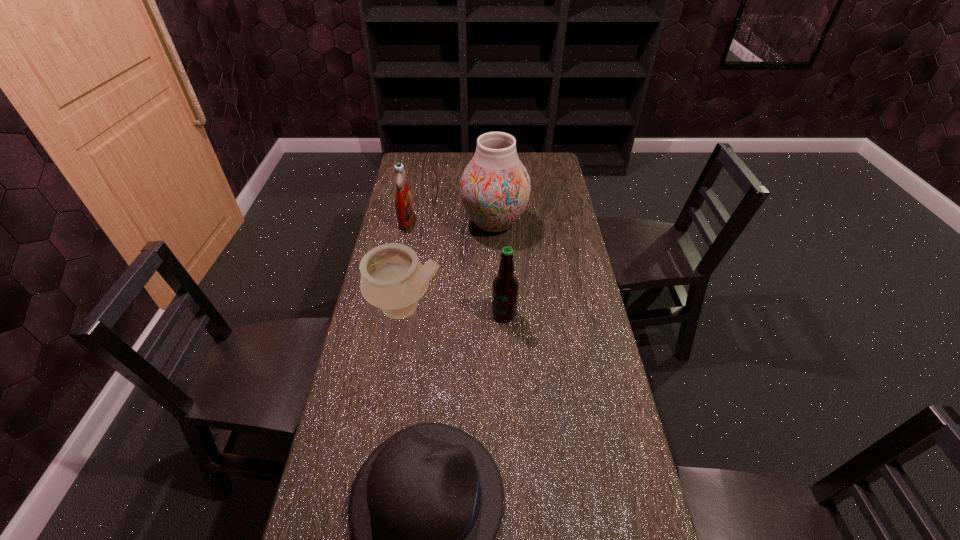
You are a GUI agent. You are given a task and a screenshot of the screen. Output one action in this format:
    pyautogui.click(x=<x>, y=<y>)
    Task: Click on the detergent that is at the left edge
    The width and height of the screenshot is (960, 540).
    Given the screenshot: What is the action you would take?
    pyautogui.click(x=403, y=199)

The width and height of the screenshot is (960, 540). Identify the location of pottery that is at the left edge. (392, 278).

Where is `vacant area at the far edge`? vacant area at the far edge is located at coordinates (442, 158).

Find the location of a particular element. The width and height of the screenshot is (960, 540). vacant space at the left edge of the desktop is located at coordinates (x=415, y=191).

You are a GUI agent. You are given a task and a screenshot of the screen. Output one action in this format:
    pyautogui.click(x=<x>, y=<y>)
    Task: Click on the vacant space at the right edge of the desktop
    
    Given the screenshot: What is the action you would take?
    pyautogui.click(x=610, y=372)

In the image, there is a desktop. At what (x,y) coordinates should I click in order to perform the action: click on vacant space at the far left corner. Please return your answer as a coordinate pair (x, y). The width and height of the screenshot is (960, 540). Looking at the image, I should click on (413, 169).

You are a GUI agent. You are given a task and a screenshot of the screen. Output one action in this format:
    pyautogui.click(x=<x>, y=<y>)
    Task: Click on the free space that is in between the pottery and the tallest object
    
    Given the screenshot: What is the action you would take?
    pyautogui.click(x=450, y=266)

I want to click on vacant region between the detergent and the beer bottle, so click(455, 267).

The width and height of the screenshot is (960, 540). In order to click on object that can be found as the fourth closest to the beer bottle in this screenshot , I will do `click(403, 199)`.

Select which object appears as the closest to the tallest object. Please provide its 2D coordinates. Your answer should be formatted as a tuple, i.e. [(x, y)], where the tuple contains the x and y coordinates of a point satisfying the conditions above.

[(403, 199)]